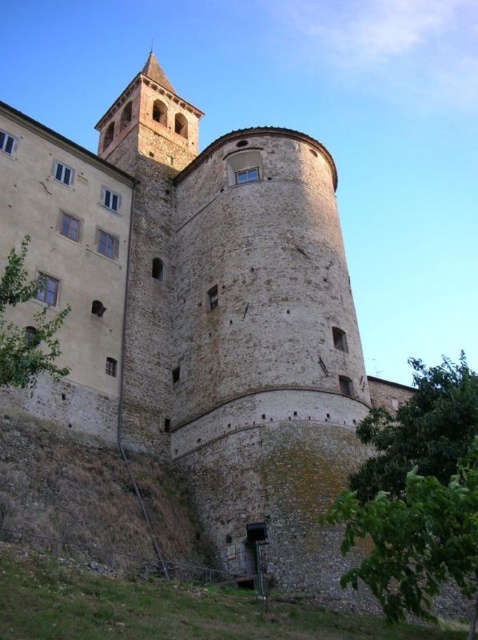
Is green leafy tree at lower right closer to camera compared to green leafy tree at lower left?

Yes, green leafy tree at lower right is closer to the viewer.

Who is more distant from viewer, (x=476, y=492) or (x=14, y=266)?

Point (x=14, y=266)

Is point (469, 540) positioned after point (0, 310)?

No.

Identify the location of green leafy tree at lower right. (416, 493).